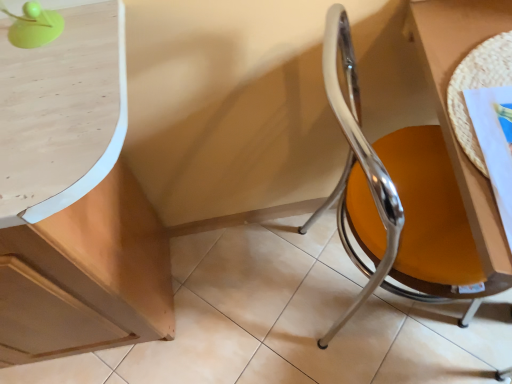
At what (x,y) coordinates should I click in order to perform the action: click on vacant space that is to the left of chrome/yellow seat at right. Please return your answer as a coordinate pair (x, y). The height and width of the screenshot is (384, 512). Looking at the image, I should click on (266, 298).